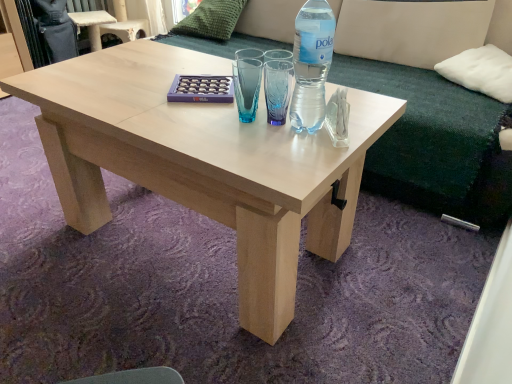
Question: Considering the positions of beige fabric couch at upper center and clear plastic bottle at center in the image, is beige fabric couch at upper center wider or thinner than clear plastic bottle at center?

Choices:
 (A) thin
 (B) wide

Answer: (B)

Question: From a real-world perspective, is beige fabric couch at upper center above or below clear plastic bottle at center?

Choices:
 (A) above
 (B) below

Answer: (B)

Question: Which of these objects is positioned farthest from the white soft cushion at upper right, which ranks as the second pillow in back-to-front order?

Choices:
 (A) natural wood coffee table at center
 (B) green textured pillow at upper center, acting as the 1th pillow starting from the left
 (C) clear plastic bottle at center
 (D) beige fabric couch at upper center

Answer: (B)

Question: Considering the real-world distances, which object is farthest from the green textured pillow at upper center, the 1th pillow positioned from the back?

Choices:
 (A) beige fabric couch at upper center
 (B) natural wood coffee table at center
 (C) clear plastic bottle at center
 (D) white soft cushion at upper right, acting as the first pillow starting from the bottom

Answer: (C)